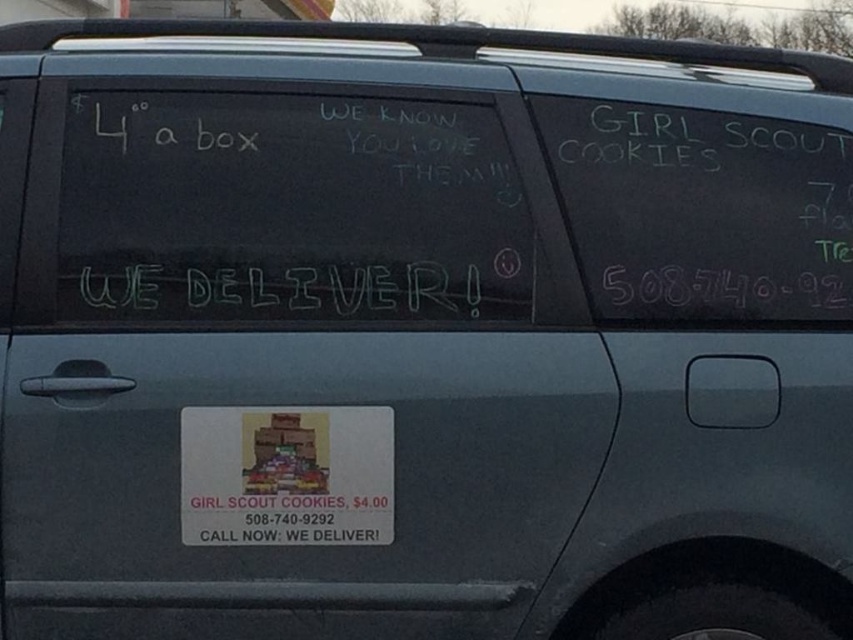
What is the relationship between the height of the white chalkboard at center and the white chalk writing at center?

The white chalkboard at center has a greater height compared to the white chalk writing at center.

You are standing in front of the SUV and notice two points on the rear window. The first point is at coordinates point(142, 308) and the second is at point(225, 292). Which point is closer to you?

Point(142, 308) is closer to the camera than point(225, 292), so the first point is closer to you.